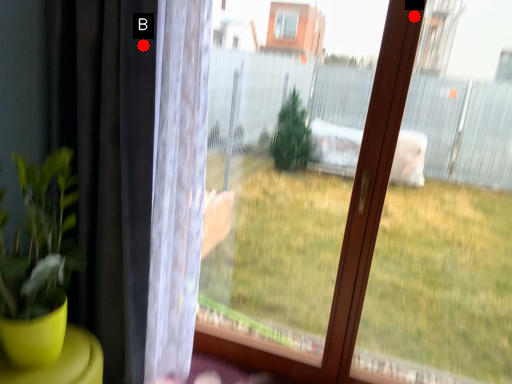
Question: Two points are circled on the image, labeled by A and B beside each circle. Which point appears farthest from the camera in this image?

Choices:
 (A) A is further
 (B) B is further

Answer: (B)